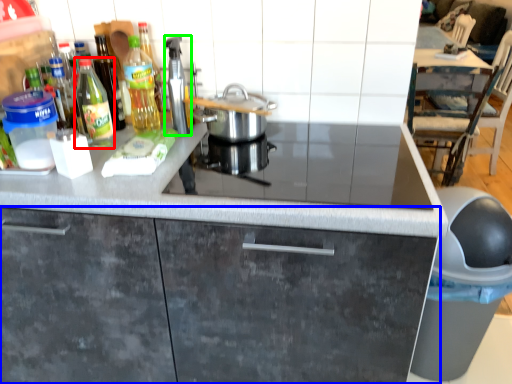
Question: Which object is the farthest from kitchen appliance (highlighted by a red box)? Choose among these: cabinetry (highlighted by a blue box) or kitchen appliance (highlighted by a green box).

Choices:
 (A) cabinetry
 (B) kitchen appliance

Answer: (A)